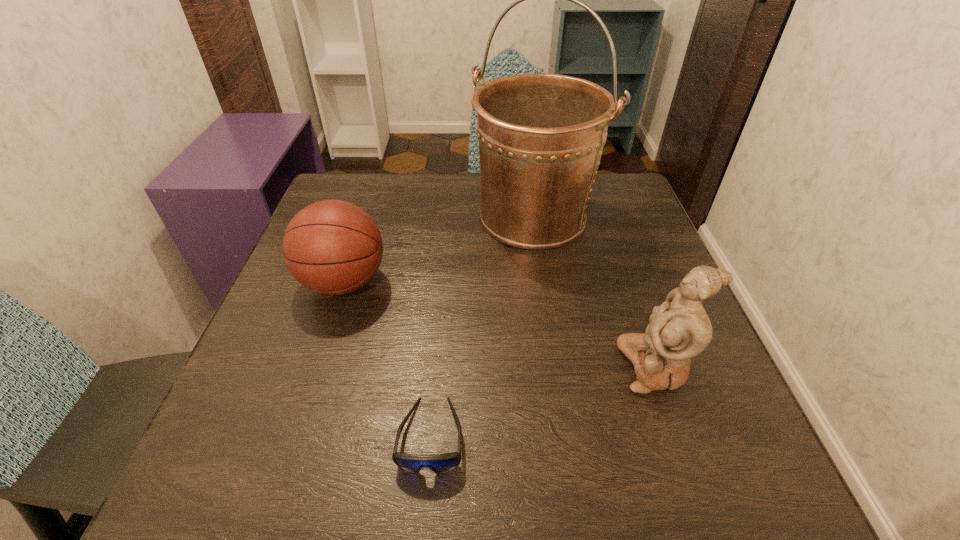
Identify the location of vacant space situated 0.080m on the front-facing side of the figurine. This screenshot has width=960, height=540. (575, 367).

What are the coordinates of `free space located 0.250m on the front of the leftmost object` in the screenshot? It's located at (294, 438).

The image size is (960, 540). Find the location of `object at the far edge`. object at the far edge is located at coordinates (541, 135).

You are a GUI agent. You are given a task and a screenshot of the screen. Output one action in this format:
    pyautogui.click(x=<x>, y=<y>)
    Task: Click on the object situated at the near edge
    The width and height of the screenshot is (960, 540).
    Given the screenshot: What is the action you would take?
    pyautogui.click(x=440, y=463)

Locate an element on the screen. object located at the left edge is located at coordinates pyautogui.click(x=332, y=247).

Locate an element on the screen. bucket at the right edge is located at coordinates (541, 135).

What are the coordinates of `figurine situated at the right edge` in the screenshot? It's located at (679, 329).

Locate an element on the screen. The width and height of the screenshot is (960, 540). object located at the far right corner is located at coordinates (541, 135).

Identify the location of vacant region at the far edge. This screenshot has width=960, height=540. (414, 180).

Where is `vacant space at the near edge`? Image resolution: width=960 pixels, height=540 pixels. vacant space at the near edge is located at coordinates (465, 449).